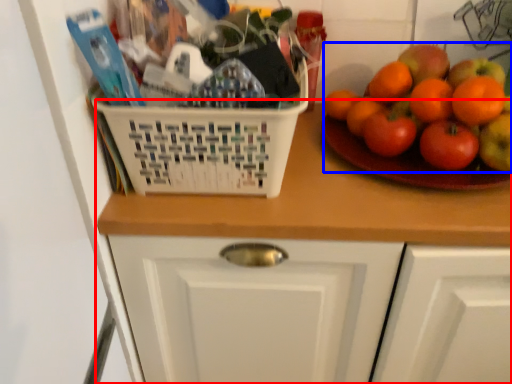
Question: Which object is closer to the camera taking this photo, counter (highlighted by a red box) or fruit (highlighted by a blue box)?

Choices:
 (A) counter
 (B) fruit

Answer: (A)